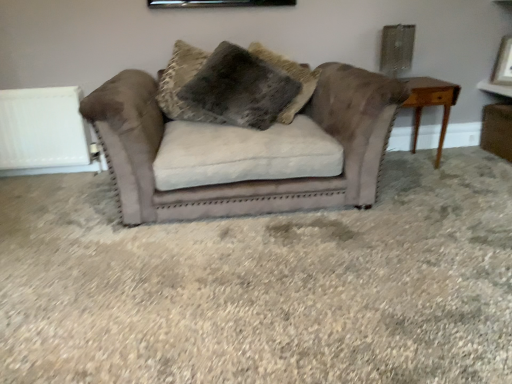
The width and height of the screenshot is (512, 384). Identify the location of vacant space in front of light brown wooden table at right. (425, 186).